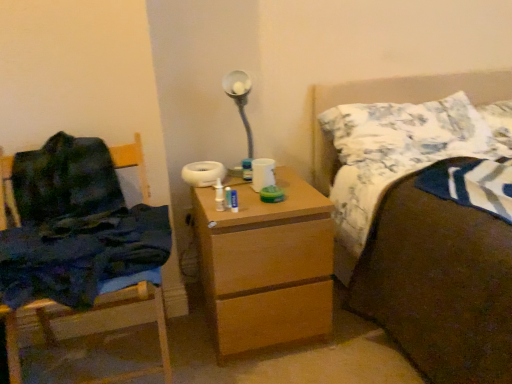
Question: From a real-world perspective, is dark blue fabric at left located beneath wooden chest of drawers at center?

Choices:
 (A) no
 (B) yes

Answer: (A)

Question: Is dark blue fabric at left smaller than wooden chest of drawers at center?

Choices:
 (A) no
 (B) yes

Answer: (B)

Question: Is dark blue fabric at left closer to the viewer compared to wooden chest of drawers at center?

Choices:
 (A) yes
 (B) no

Answer: (A)

Question: Is dark blue fabric at left turned away from wooden chest of drawers at center?

Choices:
 (A) no
 (B) yes

Answer: (A)

Question: Is dark blue fabric at left not close to wooden chest of drawers at center?

Choices:
 (A) yes
 (B) no

Answer: (B)

Question: Considering the relative sizes of dark blue fabric at left and wooden chest of drawers at center in the image provided, is dark blue fabric at left thinner than wooden chest of drawers at center?

Choices:
 (A) yes
 (B) no

Answer: (A)

Question: Can you confirm if white textured pillow at upper right, which appears as the 1th pillow when viewed from the left, is positioned to the right of brown fabric bed at upper right?

Choices:
 (A) no
 (B) yes

Answer: (A)

Question: From the image's perspective, does white textured pillow at upper right, which appears as the 1th pillow when viewed from the left, appear higher than brown fabric bed at upper right?

Choices:
 (A) yes
 (B) no

Answer: (A)

Question: Is white textured pillow at upper right, which appears as the 1th pillow when viewed from the left, in front of brown fabric bed at upper right?

Choices:
 (A) no
 (B) yes

Answer: (A)

Question: Is white textured pillow at upper right, which appears as the 1th pillow when viewed from the left, not within brown fabric bed at upper right?

Choices:
 (A) yes
 (B) no

Answer: (B)

Question: Does white textured pillow at upper right, which appears as the 1th pillow when viewed from the left, have a larger size compared to brown fabric bed at upper right?

Choices:
 (A) yes
 (B) no

Answer: (B)

Question: Considering the relative sizes of white textured pillow at upper right, which ranks as the second pillow in right-to-left order, and brown fabric bed at upper right in the image provided, is white textured pillow at upper right, which ranks as the second pillow in right-to-left order, wider than brown fabric bed at upper right?

Choices:
 (A) no
 (B) yes

Answer: (A)

Question: From the image's perspective, is wooden chair at left below wooden chest of drawers at center?

Choices:
 (A) yes
 (B) no

Answer: (A)